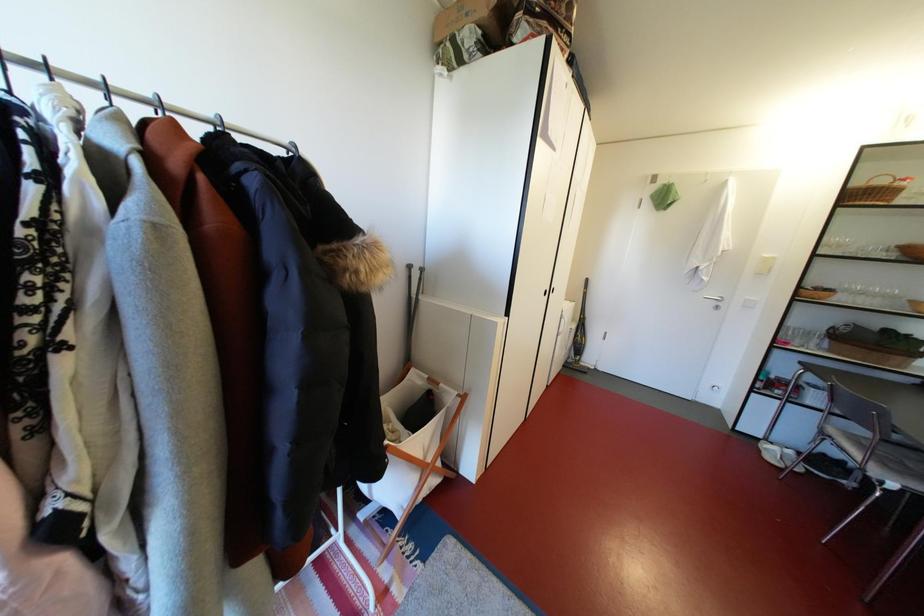
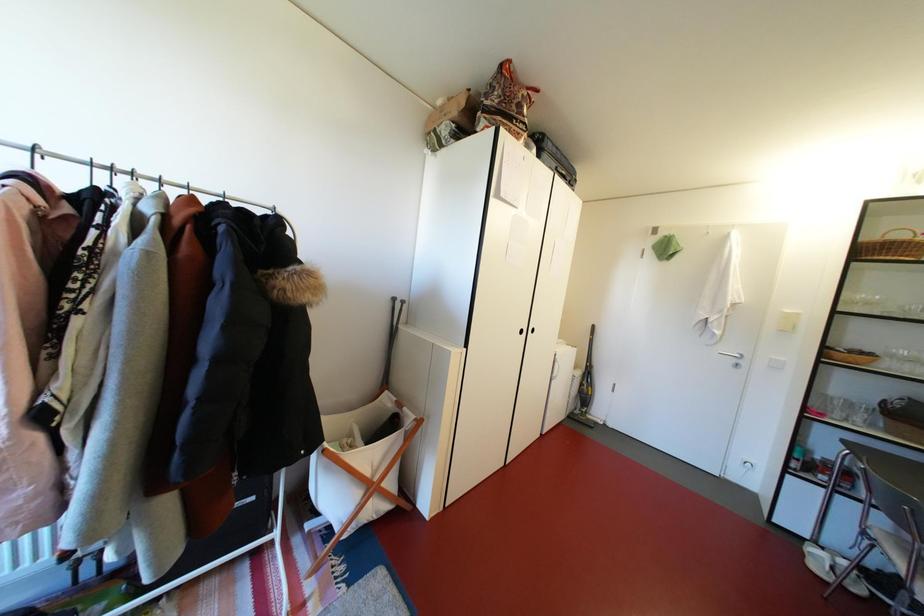
Question: Based on the continuous images, in which direction is the camera rotating? Reply with the corresponding letter.

Choices:
 (A) Left
 (B) Right
 (C) Up
 (D) Down

Answer: (C)